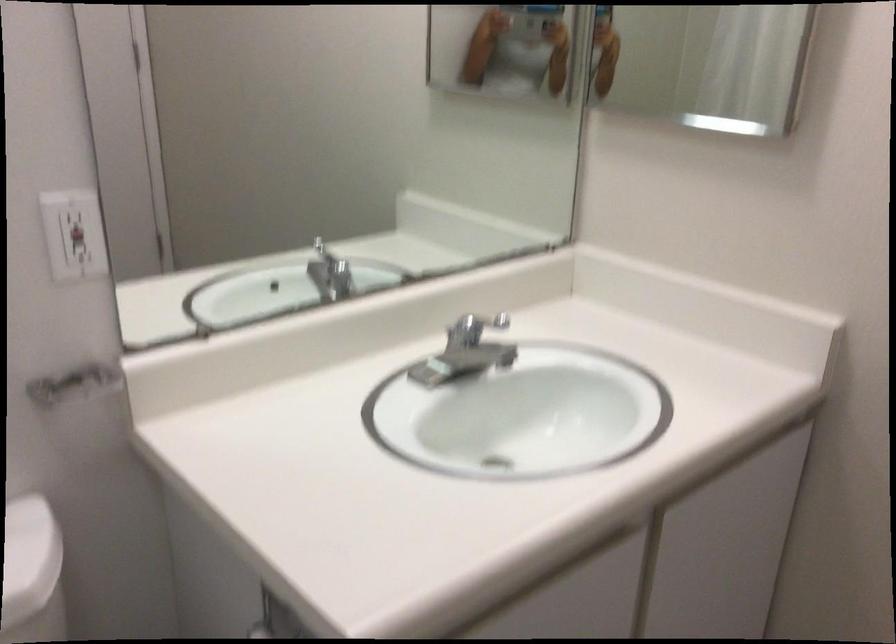
Where would you pull the sink stopper rod? Please return your answer as a coordinate pair (x, y).

(496, 462)